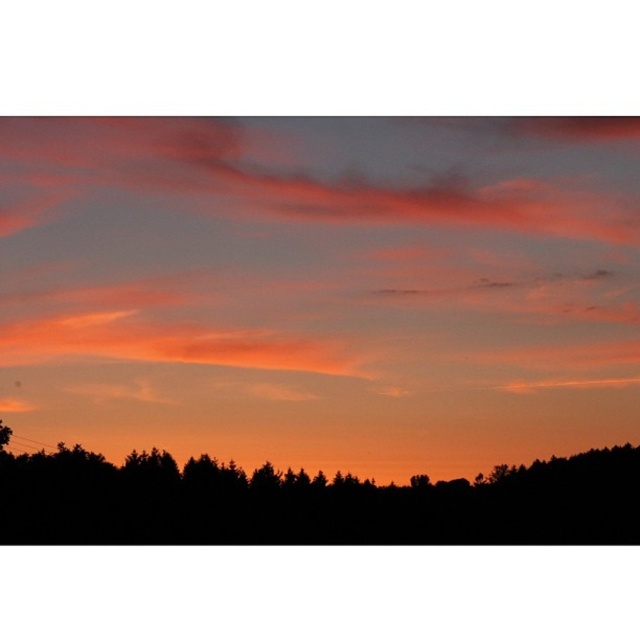
Between point (627, 243) and point (310, 493), which one is positioned in front?

Point (627, 243)

Which is more to the right, matte orange cloud at upper center or black silhouette tree at bottom?

black silhouette tree at bottom

Is point (124, 333) behind point (520, 516)?

No, it is not.

The image size is (640, 640). In order to click on matte orange cloud at upper center in this screenshot , I will do `click(321, 288)`.